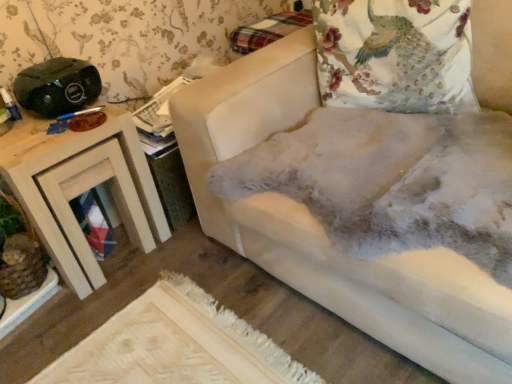
Where is `light wood side table at left`? The image size is (512, 384). light wood side table at left is located at coordinates (82, 188).

Measure the distance between light wood side table at left and camera.

light wood side table at left and camera are 3.59 feet apart from each other.

What do you see at coordinates (82, 188) in the screenshot? This screenshot has width=512, height=384. I see `light wood side table at left` at bounding box center [82, 188].

In order to click on light wood side table at left in this screenshot , I will do `click(82, 188)`.